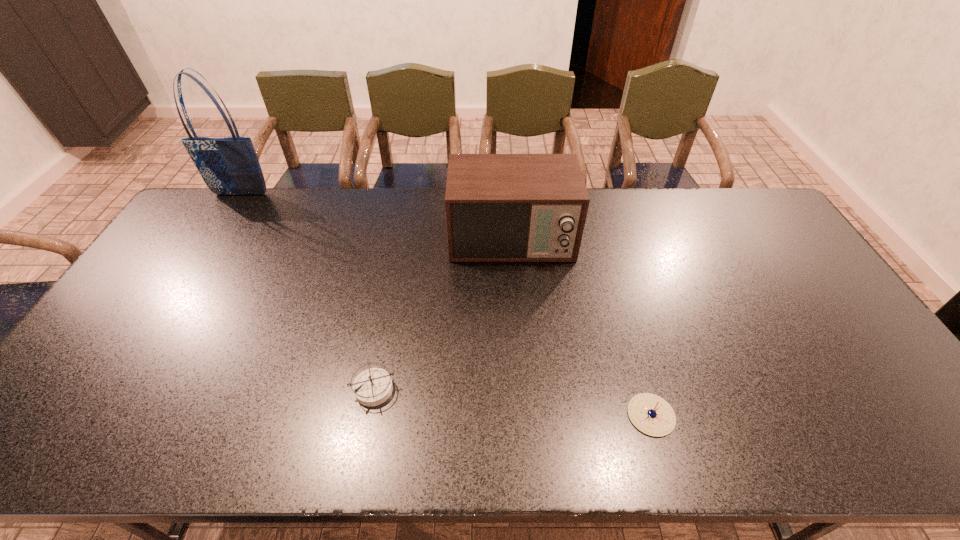
Find the location of a particular element. the farthest object is located at coordinates (229, 166).

The height and width of the screenshot is (540, 960). Identify the location of the tallest object. (229, 166).

Identify the location of radio receiver. This screenshot has width=960, height=540. (499, 207).

At what (x,y) coordinates should I click in order to perform the action: click on the second tallest object. Please return your answer as a coordinate pair (x, y). The image size is (960, 540). Looking at the image, I should click on (499, 207).

The width and height of the screenshot is (960, 540). I want to click on the third object from right to left, so click(372, 387).

You are a GUI agent. You are given a task and a screenshot of the screen. Output one action in this format:
    pyautogui.click(x=<x>, y=<y>)
    Task: Click on the right compass
    Image resolution: width=960 pixels, height=540 pixels.
    Given the screenshot: What is the action you would take?
    pyautogui.click(x=652, y=415)

You are a GUI agent. You are given a task and a screenshot of the screen. Output one action in this format:
    pyautogui.click(x=<x>, y=<y>)
    Task: Click on the vacant region located 0.310m on the front-facing side of the farthest object
    The image size is (960, 540).
    Given the screenshot: What is the action you would take?
    pyautogui.click(x=202, y=255)

Find the location of a particular element. The height and width of the screenshot is (540, 960). vacant space located 0.130m on the front-facing side of the third nearest object is located at coordinates (516, 300).

What are the coordinates of `vacant region located 0.180m on the left of the left compass` in the screenshot? It's located at (279, 388).

I want to click on free space located on the left of the right compass, so click(x=530, y=415).